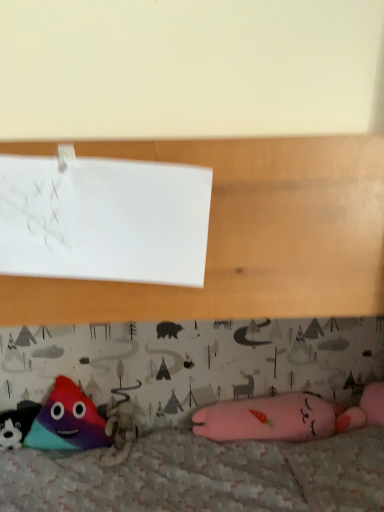
Question: Is white paper at upper left completely or partially inside multicolored plush triangle at lower left, arranged as the second toy when viewed from the right?

Choices:
 (A) yes
 (B) no

Answer: (B)

Question: Is multicolored plush triangle at lower left, arranged as the second toy when viewed from the right, closer to camera compared to white paper at upper left?

Choices:
 (A) no
 (B) yes

Answer: (A)

Question: From a real-world perspective, is multicolored plush triangle at lower left, arranged as the second toy when viewed from the right, physically above white paper at upper left?

Choices:
 (A) yes
 (B) no

Answer: (B)

Question: Is multicolored plush triangle at lower left, arranged as the second toy when viewed from the right, smaller than white paper at upper left?

Choices:
 (A) no
 (B) yes

Answer: (A)

Question: Is multicolored plush triangle at lower left, which ranks as the second toy in left-to-right order, far from white paper at upper left?

Choices:
 (A) yes
 (B) no

Answer: (A)

Question: Does multicolored plush triangle at lower left, which ranks as the second toy in left-to-right order, have a larger size compared to white paper at upper left?

Choices:
 (A) no
 (B) yes

Answer: (B)

Question: Can you confirm if multicolored plush toy at lower left, positioned as the 1th toy in left-to-right order, is smaller than multicolored plush triangle at lower left, arranged as the second toy when viewed from the right?

Choices:
 (A) no
 (B) yes

Answer: (B)

Question: Can you confirm if multicolored plush toy at lower left, the third toy positioned from the right, is bigger than multicolored plush triangle at lower left, arranged as the second toy when viewed from the right?

Choices:
 (A) yes
 (B) no

Answer: (B)

Question: Is multicolored plush toy at lower left, the third toy positioned from the right, to the right of multicolored plush triangle at lower left, which ranks as the second toy in left-to-right order, from the viewer's perspective?

Choices:
 (A) no
 (B) yes

Answer: (A)

Question: From a real-world perspective, is multicolored plush toy at lower left, positioned as the 1th toy in left-to-right order, located higher than multicolored plush triangle at lower left, arranged as the second toy when viewed from the right?

Choices:
 (A) yes
 (B) no

Answer: (B)

Question: Does multicolored plush toy at lower left, positioned as the 1th toy in left-to-right order, have a greater width compared to multicolored plush triangle at lower left, arranged as the second toy when viewed from the right?

Choices:
 (A) no
 (B) yes

Answer: (B)

Question: Could multicolored plush triangle at lower left, which ranks as the second toy in left-to-right order, be considered to be inside multicolored plush toy at lower left, the third toy positioned from the right?

Choices:
 (A) yes
 (B) no

Answer: (B)

Question: Considering the relative sizes of white paper at upper left and multicolored plush toy at lower left, the third toy positioned from the right, in the image provided, is white paper at upper left thinner than multicolored plush toy at lower left, the third toy positioned from the right,?

Choices:
 (A) no
 (B) yes

Answer: (B)